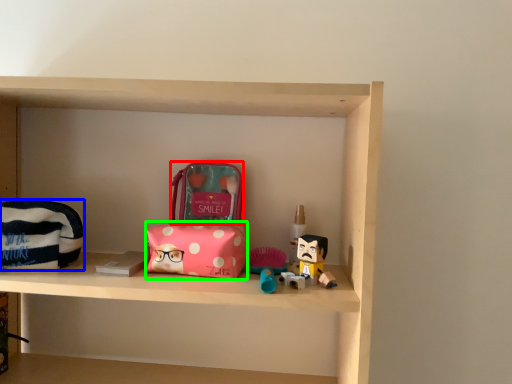
Question: Which object is the closest to the pouch (highlighted by a red box)? Choose among these: pouch (highlighted by a blue box) or package (highlighted by a green box).

Choices:
 (A) pouch
 (B) package

Answer: (B)